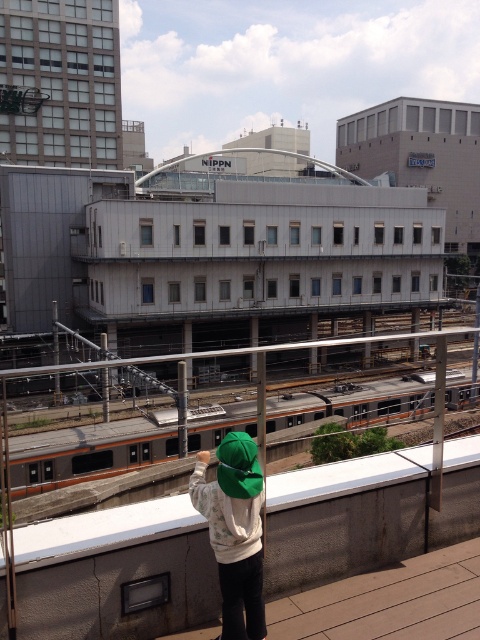
Question: Which point appears closest to the camera in this image?

Choices:
 (A) (240, 556)
 (B) (93, 500)

Answer: (A)

Question: Does orange metallic train at center appear on the right side of green fabric cap at center?

Choices:
 (A) yes
 (B) no

Answer: (A)

Question: Can you confirm if orange metallic train at center is positioned above green fabric cap at center?

Choices:
 (A) yes
 (B) no

Answer: (B)

Question: In this image, where is orange metallic train at center located relative to green fabric cap at center?

Choices:
 (A) left
 (B) right

Answer: (B)